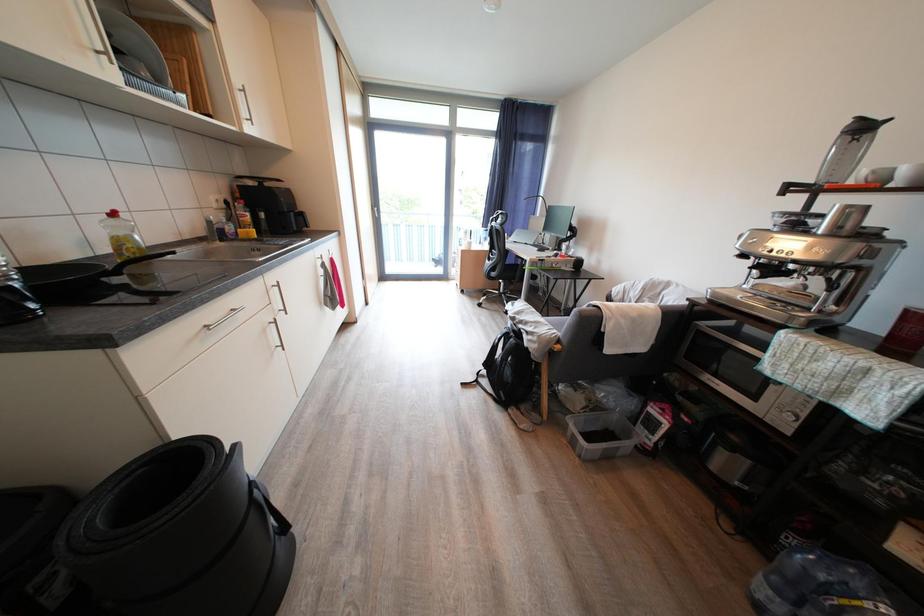
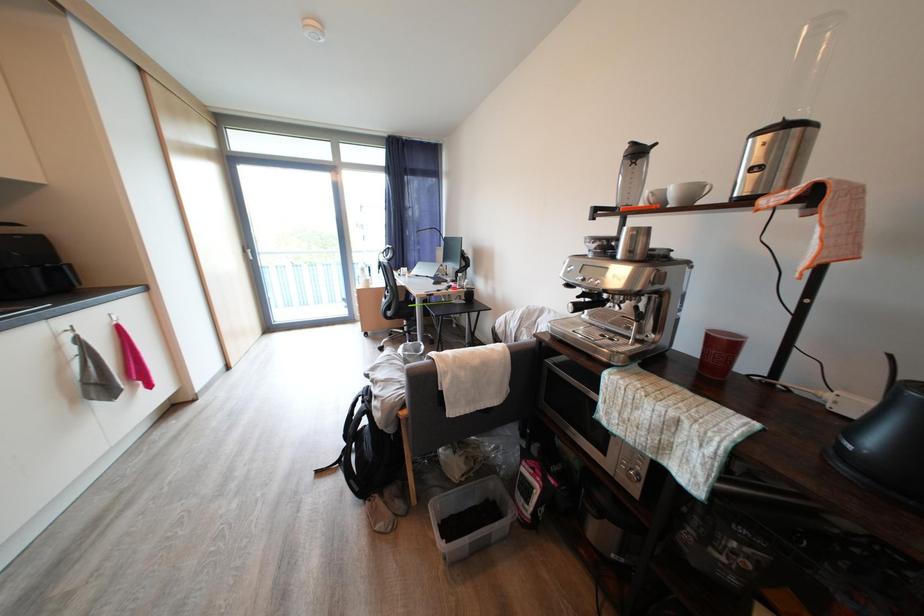
Which direction would the cameraman need to move to produce the second image?

The cameraman moved toward right, forward.